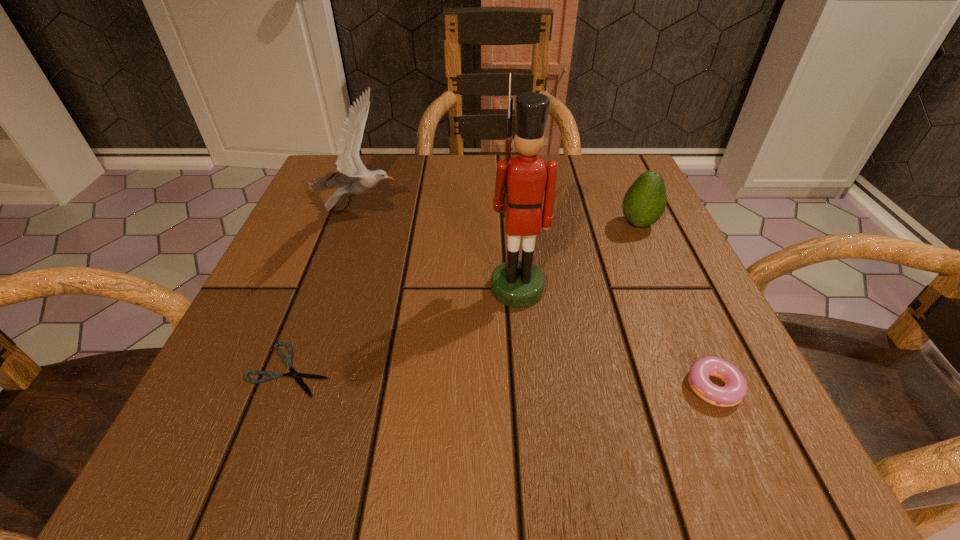
The height and width of the screenshot is (540, 960). In order to click on free space between the shortest object and the doughnut in this screenshot , I will do `click(504, 378)`.

I want to click on free spot between the gull and the avocado, so click(x=500, y=217).

Identify the location of vacant space in between the third tallest object and the fourth tallest object. (679, 305).

What are the coordinates of `object that stands as the third closest to the shortest object` in the screenshot? It's located at (735, 389).

In order to click on the fourth closest object relative to the third farthest object in this screenshot , I will do `click(288, 361)`.

Locate an element on the screen. The width and height of the screenshot is (960, 540). vacant space that satisfies the following two spatial constraints: 1. on the front side of the second shortest object; 2. on the right side of the avocado is located at coordinates (710, 387).

Locate an element on the screen. The width and height of the screenshot is (960, 540). free space that satisfies the following two spatial constraints: 1. at the tip of the beak of the gull; 2. on the left side of the third tallest object is located at coordinates (358, 224).

Where is `free space that satisfies the following two spatial constraints: 1. on the front side of the second shortest object; 2. on the left side of the avocado`? free space that satisfies the following two spatial constraints: 1. on the front side of the second shortest object; 2. on the left side of the avocado is located at coordinates (710, 387).

I want to click on vacant space that satisfies the following two spatial constraints: 1. on the back side of the third shortest object; 2. on the right side of the shortest object, so tap(345, 224).

The height and width of the screenshot is (540, 960). I want to click on free space in the image that satisfies the following two spatial constraints: 1. on the front-facing side of the doughnut; 2. on the left side of the third nearest object, so click(x=526, y=387).